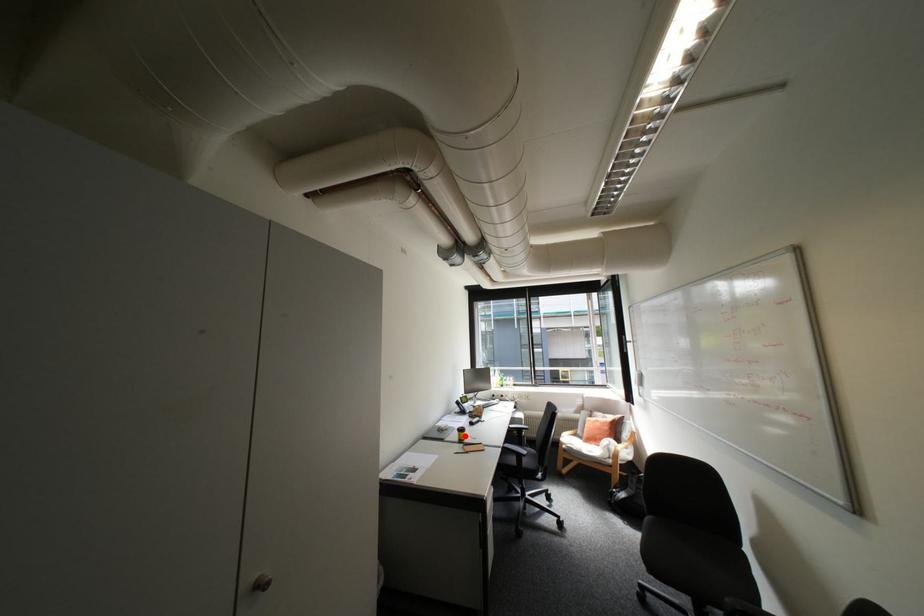
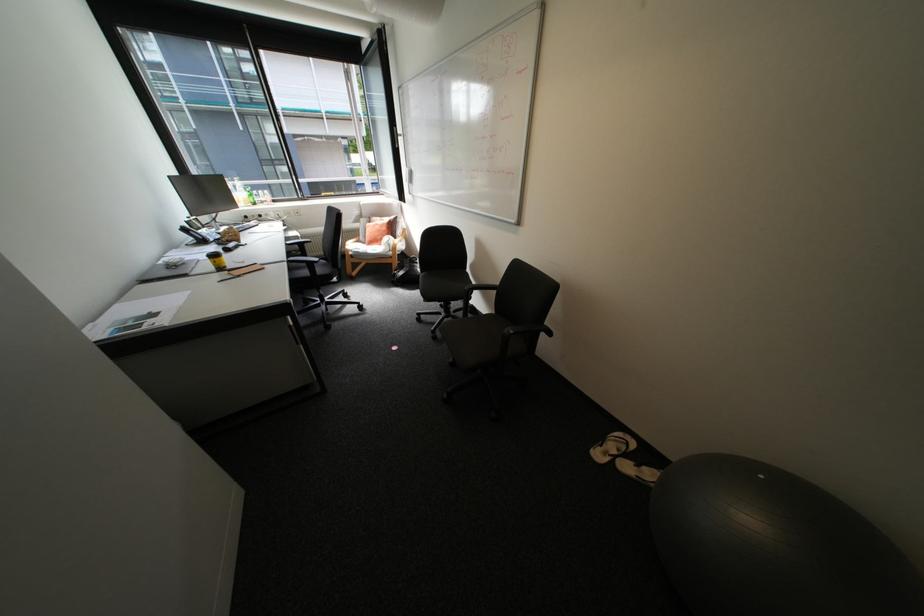
The point at the highlighted location is marked in the first image. Where is the corresponding point in the second image?

(217, 265)